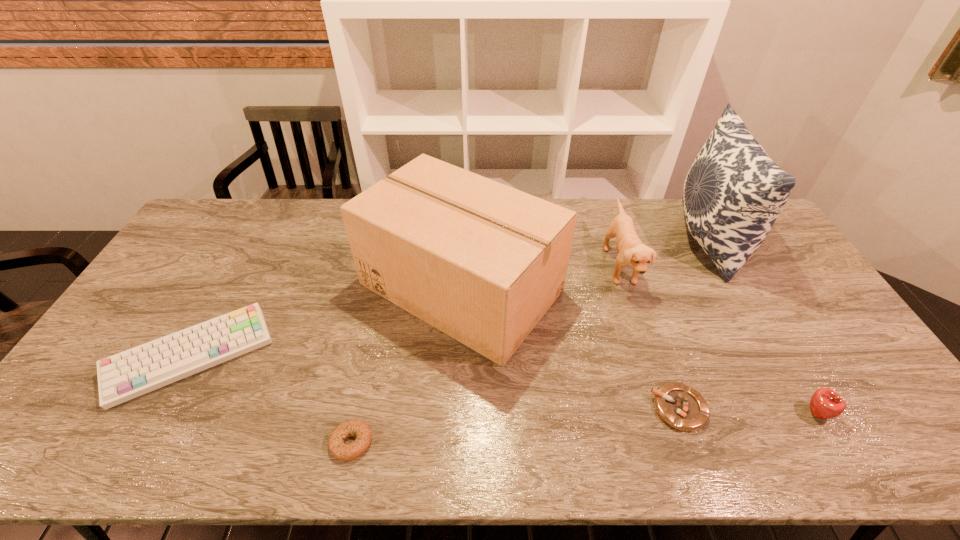
Locate an element on the screen. This screenshot has width=960, height=540. cushion is located at coordinates (733, 193).

Where is `the second tallest object`? The width and height of the screenshot is (960, 540). the second tallest object is located at coordinates (482, 262).

Find the location of `puppy`. puppy is located at coordinates (632, 252).

Locate an element on the screen. apple is located at coordinates (825, 403).

Image resolution: width=960 pixels, height=540 pixels. I want to click on the leftmost object, so click(x=129, y=374).

At what (x,y) coordinates should I click in order to perform the action: click on the fifth tallest object. Please return your answer as a coordinate pair (x, y). Image resolution: width=960 pixels, height=540 pixels. Looking at the image, I should click on (129, 374).

Where is `ashtray`? ashtray is located at coordinates (683, 408).

Image resolution: width=960 pixels, height=540 pixels. I want to click on bagel, so click(344, 452).

Locate an element on the screen. This screenshot has height=540, width=960. vacant space located 0.160m on the front surface of the cushion is located at coordinates (628, 241).

The height and width of the screenshot is (540, 960). In order to click on vacant position located on the front surface of the cushion in this screenshot , I will do `click(642, 241)`.